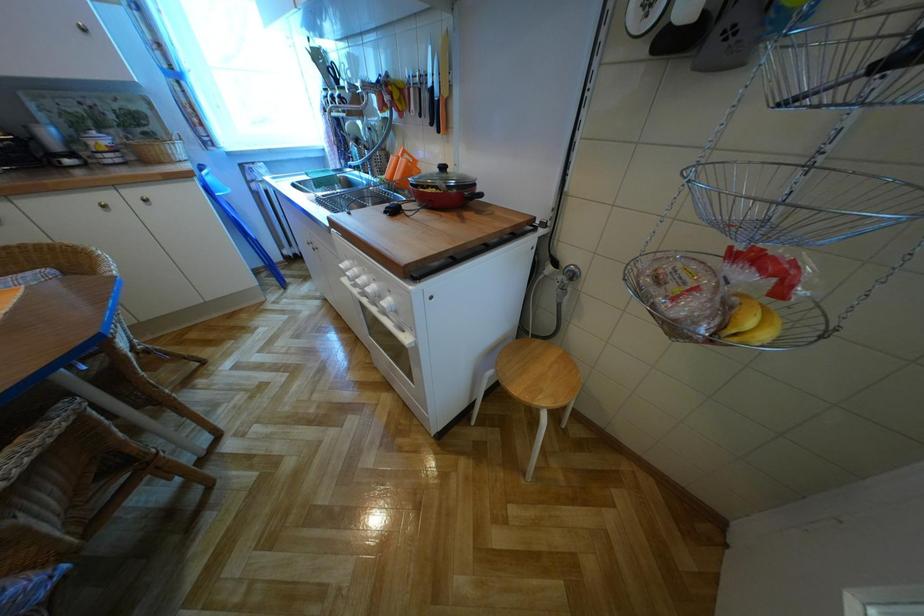
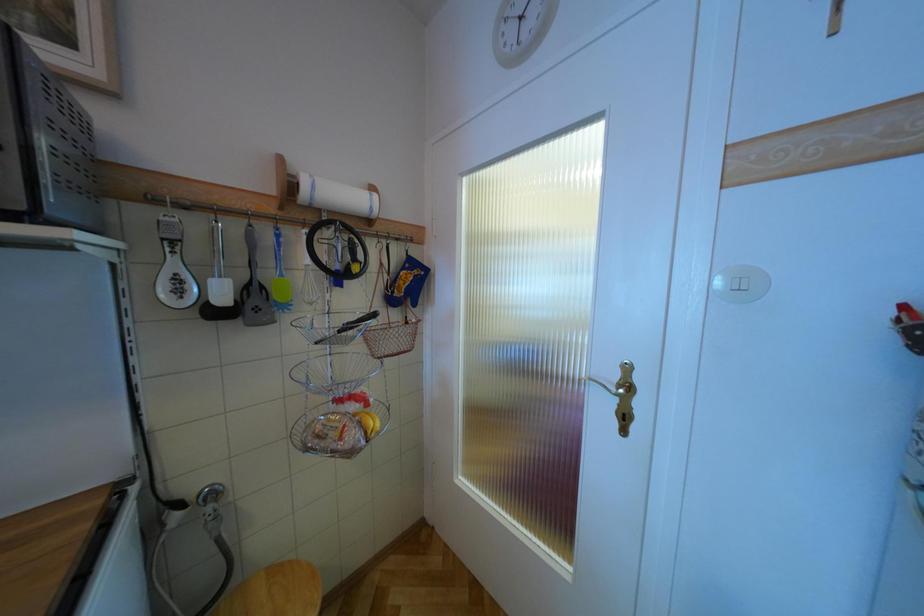
Question: How did the camera likely rotate?

Choices:
 (A) Left
 (B) Right
 (C) Up
 (D) Down

Answer: (B)